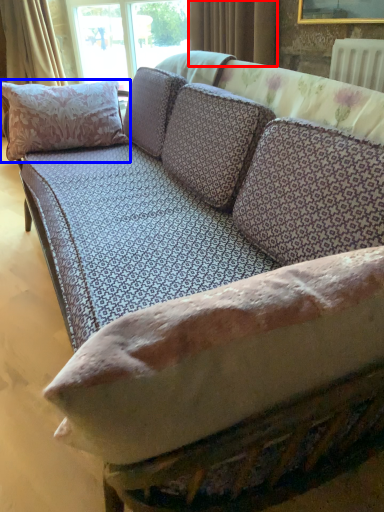
Question: Which object is further to the camera taking this photo, curtain (highlighted by a red box) or pillow (highlighted by a blue box)?

Choices:
 (A) curtain
 (B) pillow

Answer: (A)